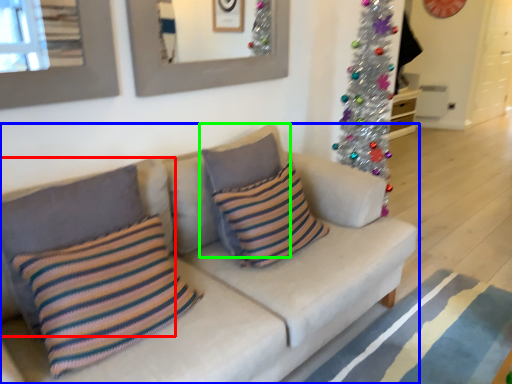
Question: Considering the real-world distances, which object is closest to pillow (highlighted by a red box)? studio couch (highlighted by a blue box) or pillow (highlighted by a green box).

Choices:
 (A) studio couch
 (B) pillow

Answer: (A)